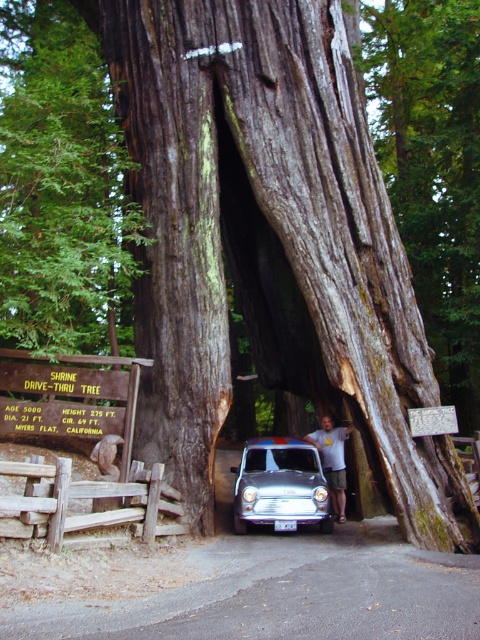
Identify the location of shiny silver car at center. Image resolution: width=480 pixels, height=640 pixels. (279, 484).

Locate an element on the screen. Image resolution: width=480 pixels, height=640 pixels. shiny silver car at center is located at coordinates (279, 484).

Find the location of a particular element. The width and height of the screenshot is (480, 640). shiny silver car at center is located at coordinates (279, 484).